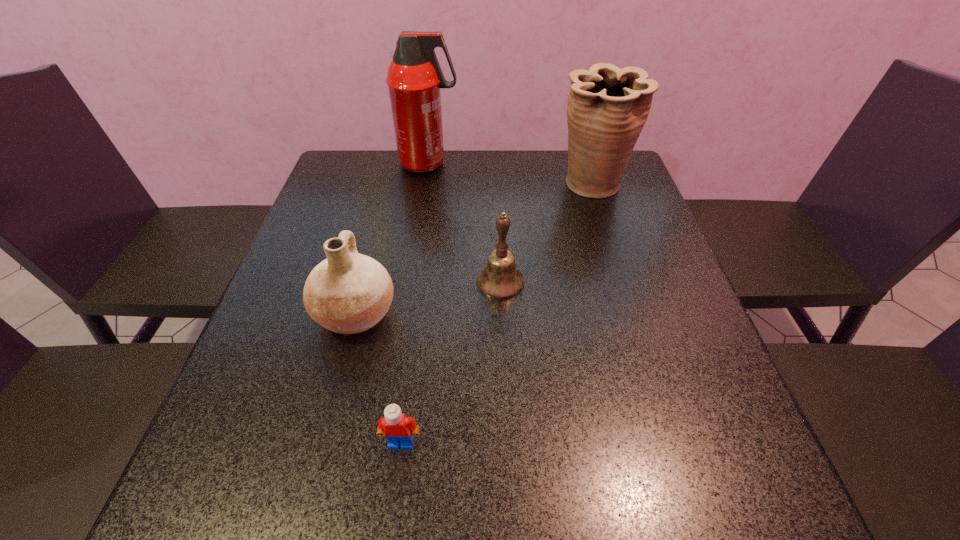
The width and height of the screenshot is (960, 540). Identify the location of fire extinguisher. (414, 78).

This screenshot has width=960, height=540. Identify the location of the second tallest object. (607, 107).

This screenshot has width=960, height=540. I want to click on the rightmost object, so click(607, 107).

Find the location of a particular element. This screenshot has width=960, height=540. pottery is located at coordinates (347, 293).

In order to click on the second object from right to left in this screenshot , I will do `click(500, 279)`.

Find the location of a particular element. Image resolution: width=960 pixels, height=540 pixels. the shortest object is located at coordinates pos(395,426).

The image size is (960, 540). Identify the location of Lego. (395, 426).

Where is `free space located 0.320m on the trigger side of the tallest object`? This screenshot has width=960, height=540. free space located 0.320m on the trigger side of the tallest object is located at coordinates (564, 164).

Locate an element on the screen. vacant area located on the front of the rightmost object is located at coordinates (609, 239).

The width and height of the screenshot is (960, 540). Find the location of `vacant point located 0.390m to pour from the handle of the pottery`. vacant point located 0.390m to pour from the handle of the pottery is located at coordinates tap(585, 314).